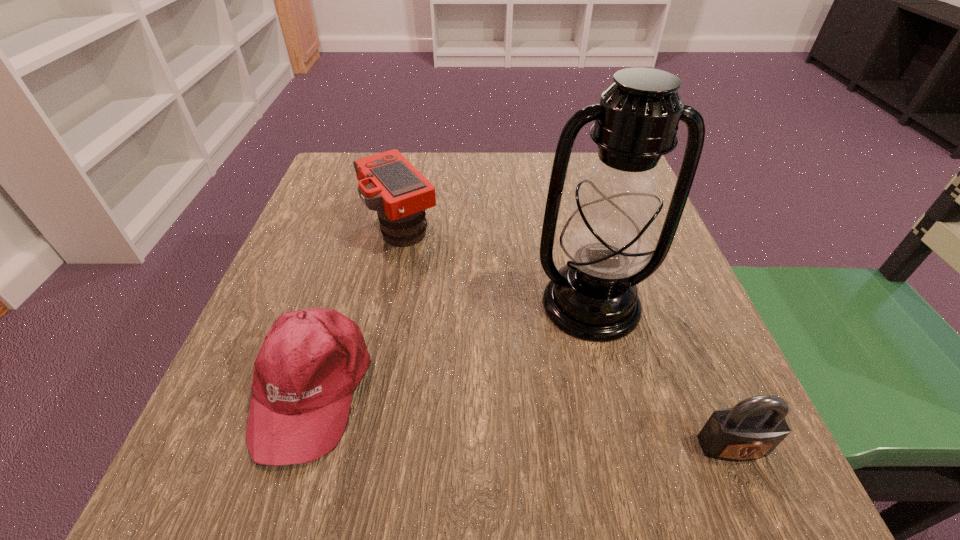
This screenshot has width=960, height=540. Identify the location of baseball cap that is at the left edge. (311, 361).

This screenshot has width=960, height=540. What are the coordinates of `oil lamp that is at the right edge` in the screenshot? It's located at (608, 238).

In order to click on padlock that is at the right edge in this screenshot , I will do `click(753, 428)`.

At what (x,y) coordinates should I click in order to perform the action: click on object present at the far left corner. Please return your answer as a coordinate pair (x, y). The height and width of the screenshot is (540, 960). Looking at the image, I should click on (388, 183).

Locate an element on the screen. object that is at the near left corner is located at coordinates (311, 361).

Where is `object at the near right corner`? This screenshot has height=540, width=960. object at the near right corner is located at coordinates (753, 428).

Identify the location of vacant space at the far edge. Image resolution: width=960 pixels, height=540 pixels. (456, 169).

I want to click on free region at the near edge, so click(588, 457).

Locate an element on the screen. vacant space at the left edge of the desktop is located at coordinates (260, 327).

Image resolution: width=960 pixels, height=540 pixels. I want to click on blank space at the right edge of the desktop, so [x=631, y=372].